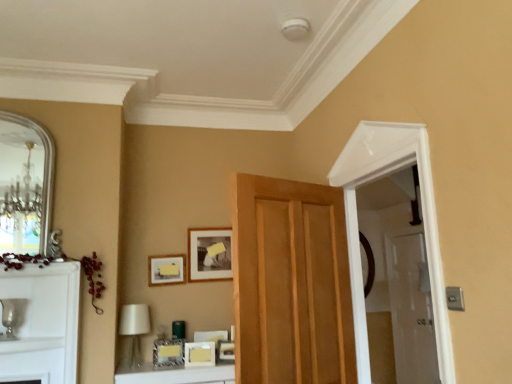
Question: Should I look upward or downward to see wooden door at center?

Choices:
 (A) up
 (B) down

Answer: (B)

Question: Is matte gold picture frame at center, the 4th picture frame positioned from the back, taller than wooden door at center?

Choices:
 (A) yes
 (B) no

Answer: (B)

Question: From a real-world perspective, is matte gold picture frame at center, the 2th picture frame from the front, on wooden door at center?

Choices:
 (A) no
 (B) yes

Answer: (A)

Question: Can you confirm if matte gold picture frame at center, the 2th picture frame from the front, is shorter than wooden door at center?

Choices:
 (A) yes
 (B) no

Answer: (A)

Question: Is matte gold picture frame at center, the 4th picture frame positioned from the back, completely or partially outside of wooden door at center?

Choices:
 (A) yes
 (B) no

Answer: (A)

Question: Could you tell me if matte gold picture frame at center, the 4th picture frame positioned from the back, is facing wooden door at center?

Choices:
 (A) no
 (B) yes

Answer: (A)

Question: Does matte gold picture frame at center, the 4th picture frame positioned from the back, appear on the left side of wooden door at center?

Choices:
 (A) yes
 (B) no

Answer: (A)

Question: Would you say matte gold picture frame at center, positioned as the fifth picture frame in back-to-front order, contains clear glass door at right?

Choices:
 (A) no
 (B) yes

Answer: (A)

Question: Is matte gold picture frame at center, positioned as the fifth picture frame in back-to-front order, far away from clear glass door at right?

Choices:
 (A) no
 (B) yes

Answer: (B)

Question: Is matte gold picture frame at center, positioned as the fifth picture frame in back-to-front order, closer to the viewer compared to clear glass door at right?

Choices:
 (A) yes
 (B) no

Answer: (A)

Question: Can you confirm if matte gold picture frame at center, positioned as the fifth picture frame in back-to-front order, is shorter than clear glass door at right?

Choices:
 (A) yes
 (B) no

Answer: (A)

Question: From a real-world perspective, is matte gold picture frame at center, positioned as the fifth picture frame in back-to-front order, below clear glass door at right?

Choices:
 (A) yes
 (B) no

Answer: (B)

Question: Is the position of matte gold picture frame at center, positioned as the fifth picture frame in back-to-front order, more distant than that of clear glass door at right?

Choices:
 (A) no
 (B) yes

Answer: (A)

Question: From a real-world perspective, is matte black picture frame at upper center, acting as the 5th picture frame starting from the front, under silver metallic mirror at left?

Choices:
 (A) yes
 (B) no

Answer: (A)